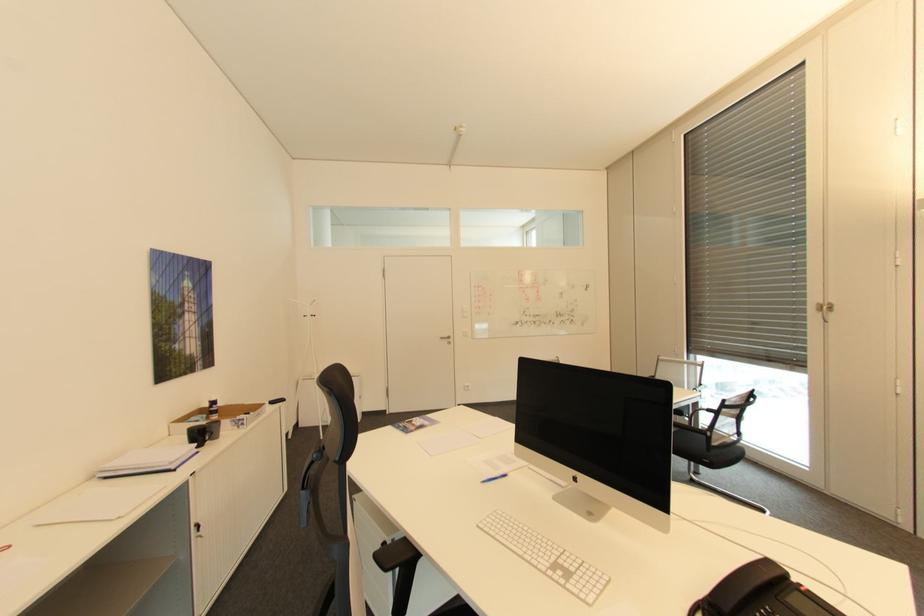
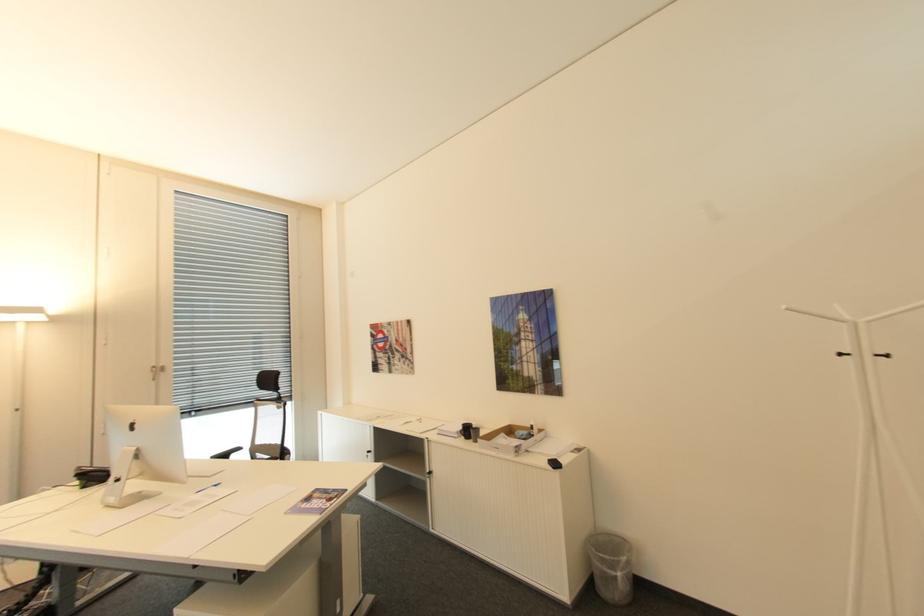
Where in the second image is the point corresponding to (321,299) from the first image?

(791, 307)